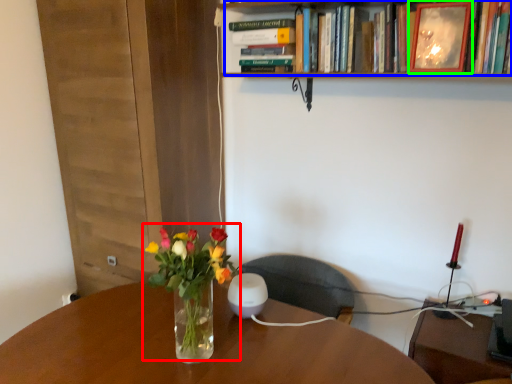
Question: Based on their relative distances, which object is nearer to floral arrangement (highlighted by a red box)? Choose from book (highlighted by a blue box) and picture frame (highlighted by a green box).

Choices:
 (A) book
 (B) picture frame

Answer: (A)